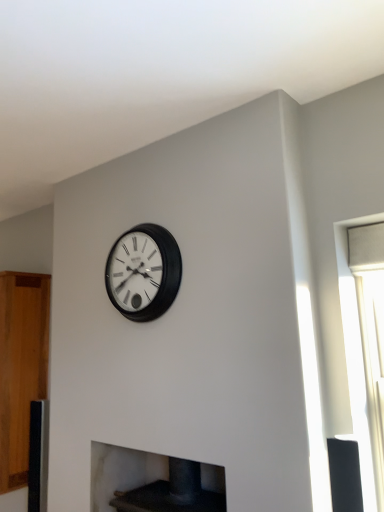
Find the location of a particular element. This screenshot has height=512, width=384. matte black clock at center is located at coordinates (143, 272).

How much distance is there between matte black clock at center and wooden cabinet at left?

A distance of 4.24 feet exists between matte black clock at center and wooden cabinet at left.

Does point (145, 312) lie behind point (7, 450)?

No, (145, 312) is closer to viewer.

Is matte black clock at center positioned far away from wooden cabinet at left?

Yes, matte black clock at center and wooden cabinet at left are quite far apart.

From the image's perspective, is dark gray stone fireplace at lower center below matte black clock at center?

Indeed, from the image's perspective, dark gray stone fireplace at lower center is shown beneath matte black clock at center.

Is dark gray stone fireplace at lower center positioned beyond the bounds of matte black clock at center?

Indeed, dark gray stone fireplace at lower center is completely outside matte black clock at center.

Is dark gray stone fireplace at lower center to the left of matte black clock at center from the viewer's perspective?

No, dark gray stone fireplace at lower center is not to the left of matte black clock at center.

Considering the positions of objects wooden cabinet at left and dark gray stone fireplace at lower center in the image provided, who is behind, wooden cabinet at left or dark gray stone fireplace at lower center?

wooden cabinet at left.

Can you tell me how much wooden cabinet at left and dark gray stone fireplace at lower center differ in facing direction?

0.0733 degrees separate the facing orientations of wooden cabinet at left and dark gray stone fireplace at lower center.

Does wooden cabinet at left have a lesser width compared to dark gray stone fireplace at lower center?

Incorrect, the width of wooden cabinet at left is not less than that of dark gray stone fireplace at lower center.

Between wooden cabinet at left and dark gray stone fireplace at lower center, which one has smaller size?

With smaller size is dark gray stone fireplace at lower center.

Considering the positions of objects dark gray stone fireplace at lower center and wooden cabinet at left in the image provided, who is more to the left, dark gray stone fireplace at lower center or wooden cabinet at left?

From the viewer's perspective, wooden cabinet at left appears more on the left side.

From the image's perspective, which one is positioned lower, dark gray stone fireplace at lower center or wooden cabinet at left?

dark gray stone fireplace at lower center.

Considering the relative sizes of dark gray stone fireplace at lower center and wooden cabinet at left in the image provided, is dark gray stone fireplace at lower center smaller than wooden cabinet at left?

Correct, dark gray stone fireplace at lower center occupies less space than wooden cabinet at left.

Which is correct: dark gray stone fireplace at lower center is inside wooden cabinet at left, or outside of it?

dark gray stone fireplace at lower center is not inside wooden cabinet at left, it's outside.

From the image's perspective, who appears lower, matte black clock at center or dark gray stone fireplace at lower center?

dark gray stone fireplace at lower center, from the image's perspective.

In terms of width, does matte black clock at center look wider or thinner when compared to dark gray stone fireplace at lower center?

matte black clock at center is thinner than dark gray stone fireplace at lower center.

In the scene shown: Is matte black clock at center to the right of dark gray stone fireplace at lower center from the viewer's perspective?

No, matte black clock at center is not to the right of dark gray stone fireplace at lower center.

Considering the relative sizes of matte black clock at center and dark gray stone fireplace at lower center in the image provided, is matte black clock at center shorter than dark gray stone fireplace at lower center?

No, matte black clock at center is not shorter than dark gray stone fireplace at lower center.

Between point (32, 366) and point (162, 248), which one is positioned in front?

The point (162, 248) is closer.

Can we say wooden cabinet at left lies outside matte black clock at center?

wooden cabinet at left is positioned outside matte black clock at center.

Is wooden cabinet at left smaller than matte black clock at center?

Actually, wooden cabinet at left might be larger than matte black clock at center.

Where is `cabinetry that appears behind the matte black clock at center`? This screenshot has height=512, width=384. cabinetry that appears behind the matte black clock at center is located at coordinates (21, 367).

Image resolution: width=384 pixels, height=512 pixels. In order to click on fireplace below the matte black clock at center (from the image's perspective) in this screenshot , I will do `click(122, 472)`.

Based on their spatial positions, is wooden cabinet at left or matte black clock at center closer to dark gray stone fireplace at lower center?

The object closer to dark gray stone fireplace at lower center is wooden cabinet at left.

Which object lies nearer to the anchor point wooden cabinet at left, dark gray stone fireplace at lower center or matte black clock at center?

dark gray stone fireplace at lower center is closer to wooden cabinet at left.

From the image, which object appears to be nearer to matte black clock at center, dark gray stone fireplace at lower center or wooden cabinet at left?

dark gray stone fireplace at lower center lies closer to matte black clock at center than the other object.

Based on their spatial positions, is matte black clock at center or wooden cabinet at left further from dark gray stone fireplace at lower center?

matte black clock at center is positioned further to the anchor dark gray stone fireplace at lower center.

Based on the photo, looking at the image, which one is located further to wooden cabinet at left, matte black clock at center or dark gray stone fireplace at lower center?

matte black clock at center.

When comparing their distances from matte black clock at center, does wooden cabinet at left or dark gray stone fireplace at lower center seem further?

wooden cabinet at left is positioned further to the anchor matte black clock at center.

I want to click on wall clock between wooden cabinet at left and dark gray stone fireplace at lower center, so click(143, 272).